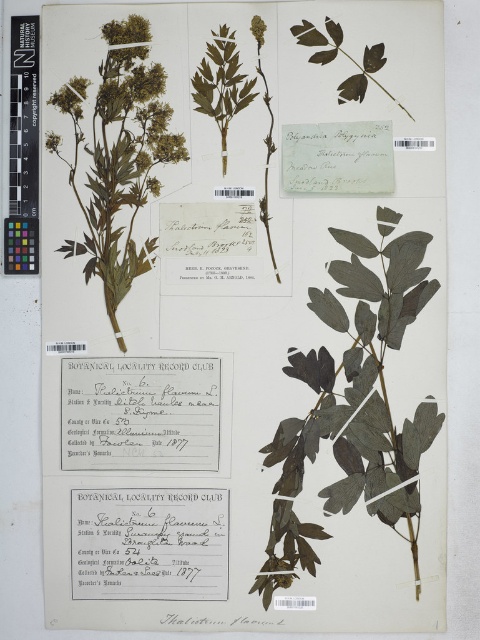
Question: Considering the real-world distances, which object is closest to the green matte herb at center?

Choices:
 (A) dark green leafy plant at center
 (B) greenish-yellow herbaceous plant at upper left

Answer: (B)

Question: Among these points, which one is farthest from the camera?

Choices:
 (A) (228, 68)
 (B) (399, 452)
 (C) (92, 218)

Answer: (C)

Question: Is dark green leafy plant at center closer to camera compared to green matte herb at center?

Choices:
 (A) yes
 (B) no

Answer: (A)

Question: Based on their relative distances, which object is nearer to the green matte herb at center?

Choices:
 (A) greenish-yellow herbaceous plant at upper left
 (B) dark green leafy plant at center

Answer: (A)

Question: Is dark green leafy plant at center smaller than green matte herb at center?

Choices:
 (A) yes
 (B) no

Answer: (B)

Question: Is the position of dark green leafy plant at center less distant than that of green matte herb at center?

Choices:
 (A) yes
 (B) no

Answer: (A)